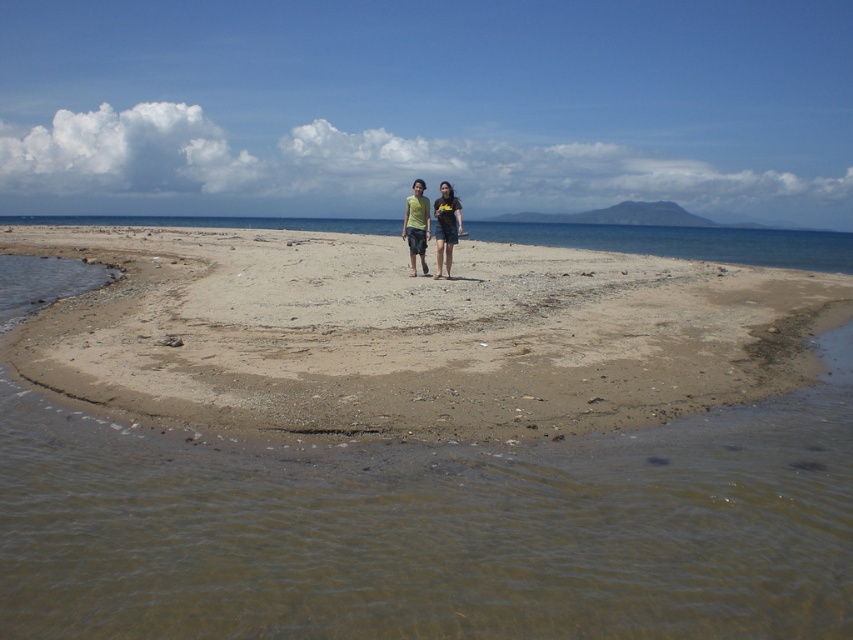
Question: Does brown sandy beach at center appear on the right side of matte yellow t-shirt at center?

Choices:
 (A) yes
 (B) no

Answer: (B)

Question: Where is brown sandy beach at center located in relation to matte yellow t-shirt at center in the image?

Choices:
 (A) below
 (B) above

Answer: (A)

Question: Which point is farther to the camera?

Choices:
 (A) (416, 214)
 (B) (129, 349)
 (C) (437, 218)

Answer: (A)

Question: Which point is closer to the camera taking this photo?

Choices:
 (A) (409, 260)
 (B) (292, 320)

Answer: (B)

Question: Which object is farther from the camera taking this photo?

Choices:
 (A) brown sandy beach at center
 (B) dark blue denim shorts at center
 (C) matte green shirt at center
 (D) matte yellow t-shirt at center

Answer: (D)

Question: Considering the relative positions of matte green shirt at center and matte yellow t-shirt at center in the image provided, where is matte green shirt at center located with respect to matte yellow t-shirt at center?

Choices:
 (A) right
 (B) left

Answer: (A)